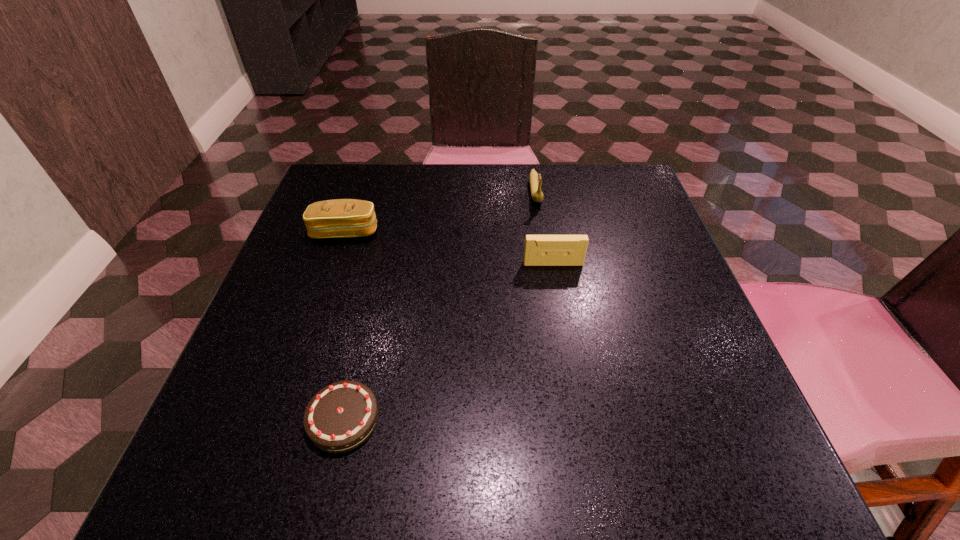
I want to click on object positioned at the far edge, so click(x=535, y=179).

This screenshot has height=540, width=960. What are the coordinates of `object positioned at the near edge` in the screenshot? It's located at (340, 417).

Identify the location of clutch bag present at the left edge. (341, 218).

Locate an element on the screen. The height and width of the screenshot is (540, 960). chocolate cake that is positioned at the left edge is located at coordinates (340, 417).

Identify the location of object that is positioned at the near left corner. (340, 417).

Locate an element on the screen. free space at the far edge is located at coordinates (509, 190).

Where is `free space at the near edge`? free space at the near edge is located at coordinates (640, 445).

At what (x,y) coordinates should I click in order to perform the action: click on vacant space at the left edge of the desktop. Please return your answer as a coordinate pair (x, y). This screenshot has width=960, height=540. Looking at the image, I should click on (300, 310).

Locate an element on the screen. This screenshot has width=960, height=540. vacant region at the right edge of the desktop is located at coordinates (615, 279).

In the image, there is a desktop. Where is `vacant space at the far left corner`? This screenshot has width=960, height=540. vacant space at the far left corner is located at coordinates (387, 167).